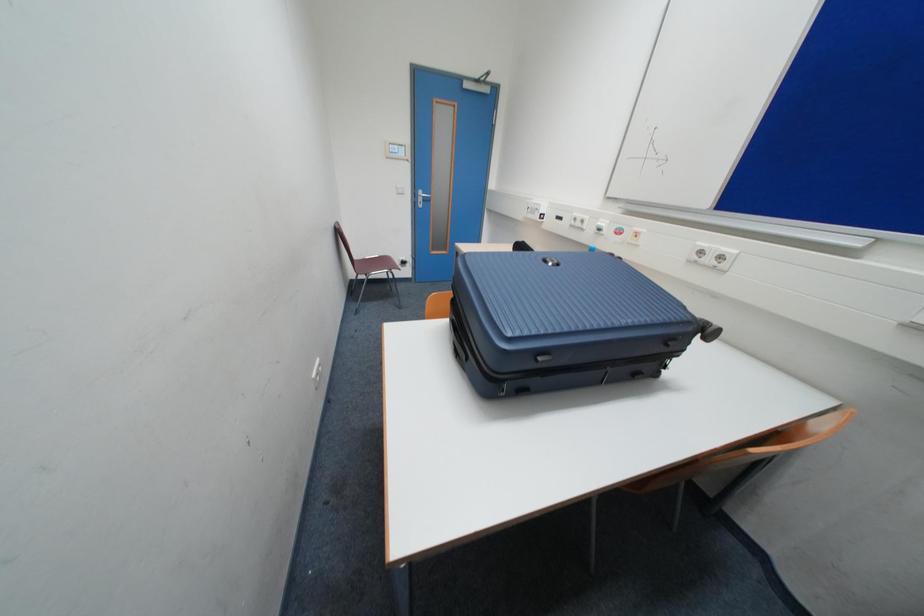
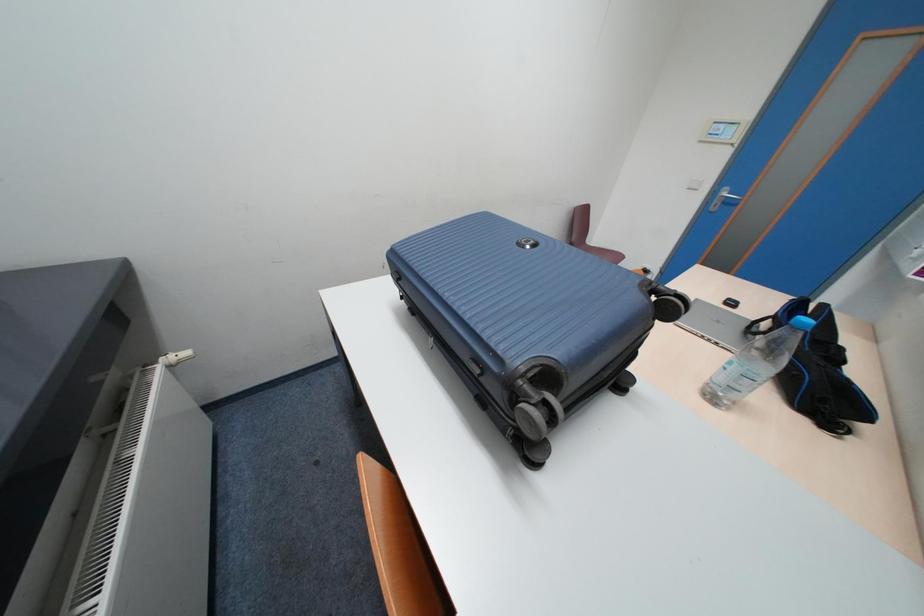
The images are taken continuously from a first-person perspective. In which direction is your viewpoint rotating?

The rotation direction of the camera is left-down.